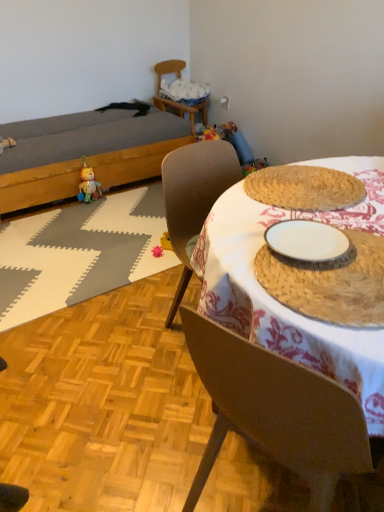
Question: Does rattan placemat at center lie behind white ceramic plate at center?

Choices:
 (A) no
 (B) yes

Answer: (A)

Question: Is rattan placemat at center aimed at white ceramic plate at center?

Choices:
 (A) yes
 (B) no

Answer: (B)

Question: Are rattan placemat at center and white ceramic plate at center making contact?

Choices:
 (A) yes
 (B) no

Answer: (B)

Question: Does rattan placemat at center have a lesser width compared to white ceramic plate at center?

Choices:
 (A) no
 (B) yes

Answer: (A)

Question: From the image's perspective, is rattan placemat at center beneath white ceramic plate at center?

Choices:
 (A) yes
 (B) no

Answer: (B)

Question: Does point (92, 185) appear closer or farther from the camera than point (334, 238)?

Choices:
 (A) closer
 (B) farther

Answer: (B)

Question: From a real-world perspective, is plush yellow bear at lower left, which appears as the first toy when viewed from the back, physically located above or below white matte plate at center?

Choices:
 (A) above
 (B) below

Answer: (B)

Question: From the image's perspective, is plush yellow bear at lower left, the 2th toy in the front-to-back sequence, located above or below white matte plate at center?

Choices:
 (A) above
 (B) below

Answer: (A)

Question: Considering the relative positions of plush yellow bear at lower left, the 2th toy in the front-to-back sequence, and white matte plate at center in the image provided, is plush yellow bear at lower left, the 2th toy in the front-to-back sequence, to the left or to the right of white matte plate at center?

Choices:
 (A) left
 (B) right

Answer: (A)

Question: Considering the positions of point (x=160, y=246) and point (x=14, y=230), is point (x=160, y=246) closer or farther from the camera than point (x=14, y=230)?

Choices:
 (A) farther
 (B) closer

Answer: (B)

Question: Is pink rubber toy at center, the second toy from the back, inside or outside of woven straw placemat at center?

Choices:
 (A) inside
 (B) outside

Answer: (B)

Question: Relative to woven straw placemat at center, is pink rubber toy at center, which is the 2th toy in top-to-bottom order, in front or behind?

Choices:
 (A) behind
 (B) front

Answer: (A)

Question: Looking at the image, does pink rubber toy at center, the 1th toy in the front-to-back sequence, seem bigger or smaller compared to woven straw placemat at center?

Choices:
 (A) big
 (B) small

Answer: (B)

Question: From their relative heights in the image, would you say rattan placemat at center is taller or shorter than white matte plate at center?

Choices:
 (A) short
 (B) tall

Answer: (B)

Question: Considering the positions of point (352, 334) and point (340, 252), is point (352, 334) closer or farther from the camera than point (340, 252)?

Choices:
 (A) farther
 (B) closer

Answer: (B)